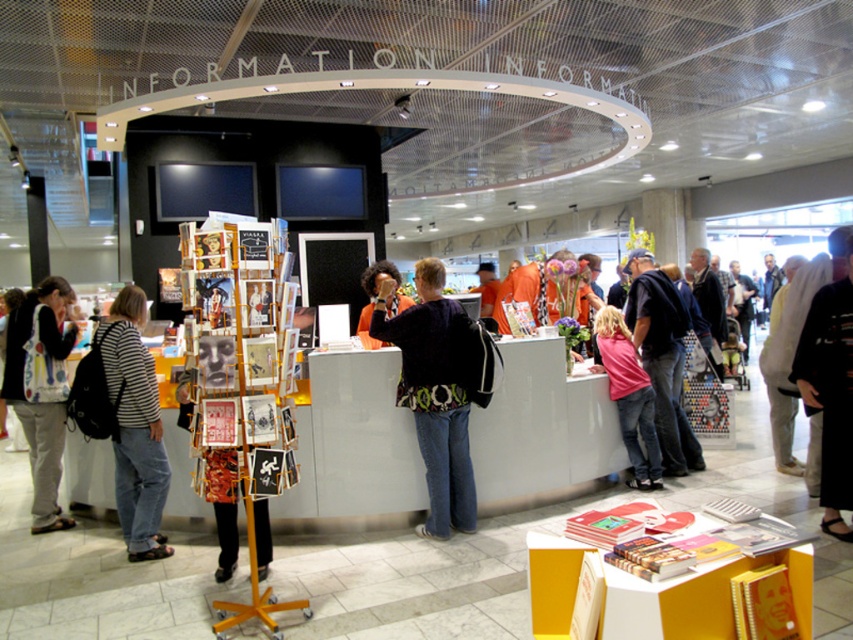
You are standing in front of the information desk and notice two clothing items hanging on a rack nearby. The dark blue sweater at center and the orange fabric shirt at center. Which clothing item is closer to the floor?

The dark blue sweater at center is closer to the floor because it is positioned under the orange fabric shirt at center.

You are standing at the information desk in the scene and want to reach a point that is 13.07 feet away from the camera. Is the point at coordinates point (432,369) the correct location to go to?

Yes, the point at coordinates point (432,369) is exactly 13.07 feet away from the camera, so it is the correct location to go to.

In the scene shown: You are trying to decide which shirt to wear for a casual day out. You have the striped cotton shirt at left and the pink fabric shirt at center. Based on their sizes in the image, which one might require a larger hanger?

The striped cotton shirt at left might require a larger hanger since it is wider than the pink fabric shirt at center according to the image.